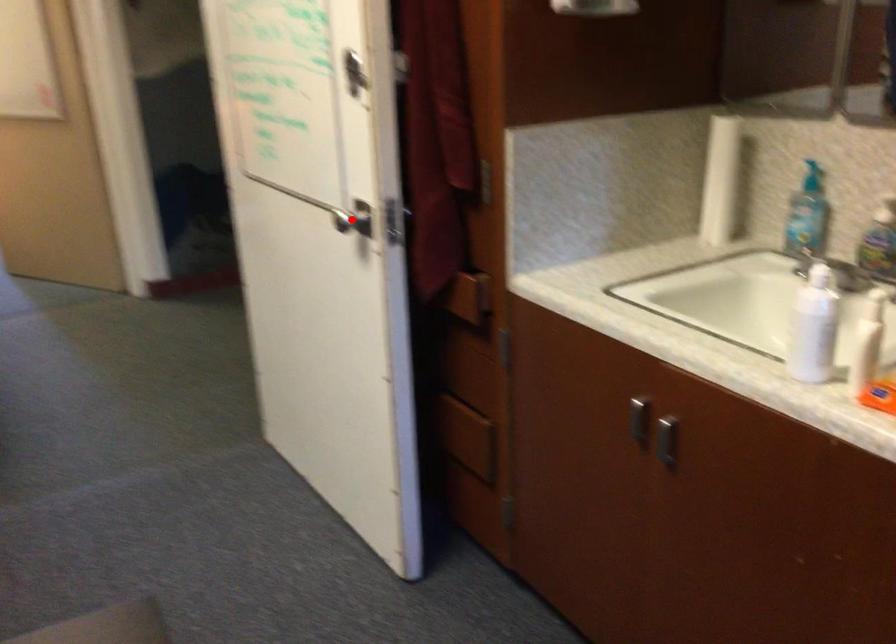
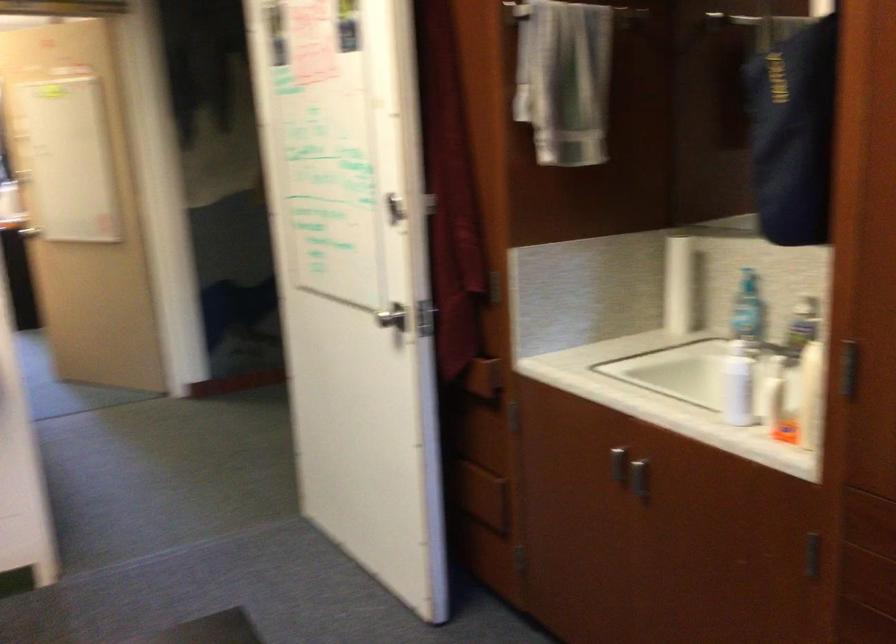
Question: I am providing you with two images of the same scene from different viewpoints. A red point is shown in image1. For the corresponding object point in image2, is it positioned nearer or farther from the camera?

Choices:
 (A) Nearer
 (B) Farther

Answer: (B)